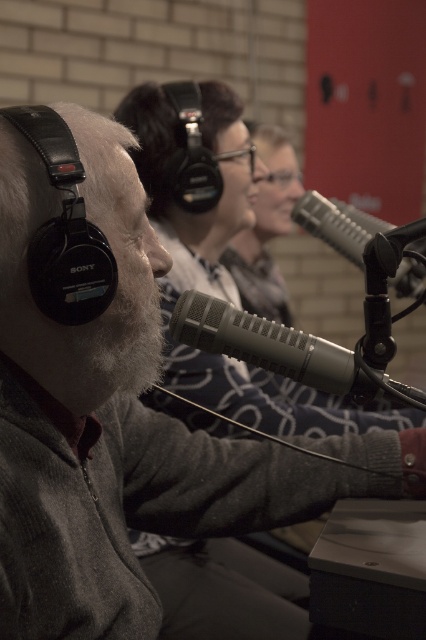
Is point (224, 337) positioned in front of point (356, 264)?

That is True.

Which is behind, point (253, 353) or point (336, 212)?

The point (336, 212) is more distant.

What do you see at coordinates (281, 349) in the screenshot?
I see `matte black microphone at center` at bounding box center [281, 349].

Where is `matte black microphone at center`? Image resolution: width=426 pixels, height=640 pixels. matte black microphone at center is located at coordinates (281, 349).